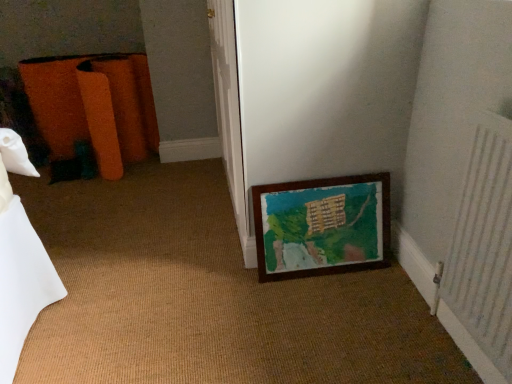
This screenshot has height=384, width=512. I want to click on free spot in front of wooden frame at lower right, so click(x=334, y=316).